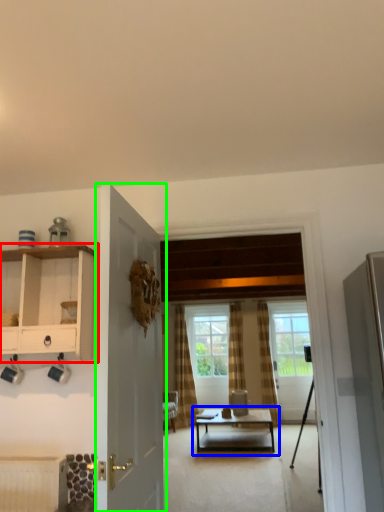
Question: Based on their relative distances, which object is nearer to cabinetry (highlighted by a red box)? Choose from coffee table (highlighted by a blue box) and door (highlighted by a green box).

Choices:
 (A) coffee table
 (B) door

Answer: (B)